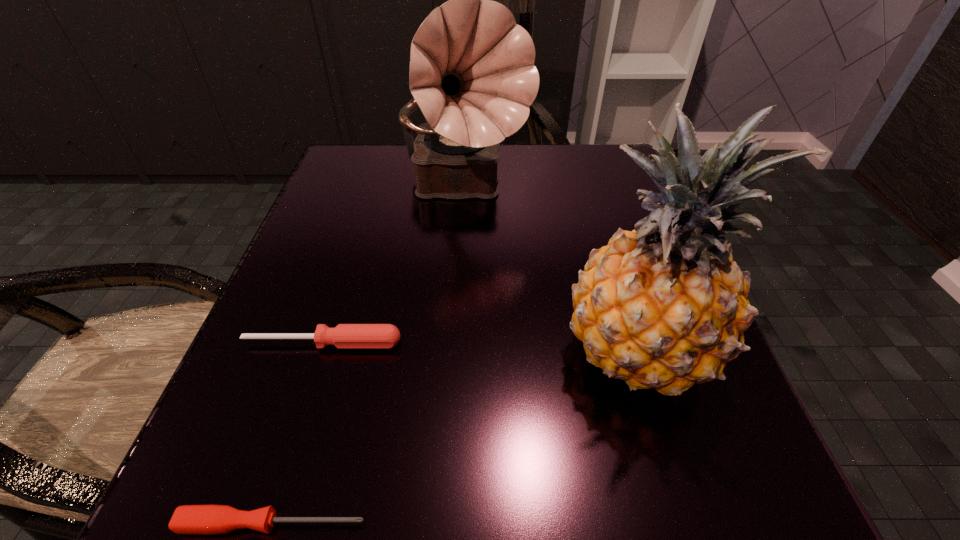
Where is `free space between the record player and the pineapple`? The height and width of the screenshot is (540, 960). free space between the record player and the pineapple is located at coordinates (550, 269).

The image size is (960, 540). In order to click on free space that is in between the record player and the shortest object in this screenshot , I will do `click(369, 356)`.

Select which object appears as the third closest to the pineapple. Please provide its 2D coordinates. Your answer should be formatted as a tuple, i.e. [(x, y)], where the tuple contains the x and y coordinates of a point satisfying the conditions above.

[(188, 519)]

At what (x,y) coordinates should I click in order to perform the action: click on object that is the second closest one to the record player. Please return your answer as a coordinate pair (x, y). Looking at the image, I should click on [x=344, y=336].

This screenshot has height=540, width=960. I want to click on vacant space that satisfies the following two spatial constraints: 1. from the horn of the pineapple; 2. on the left side of the farthest object, so click(457, 349).

In order to click on blank space that satisfies the following two spatial constraints: 1. from the horn of the rightmost object; 2. on the left side of the farthest object in this screenshot , I will do [x=457, y=349].

Where is `vacant region that satisfies the following two spatial constraints: 1. from the horn of the farthest object; 2. at the tip of the nearest object`? The image size is (960, 540). vacant region that satisfies the following two spatial constraints: 1. from the horn of the farthest object; 2. at the tip of the nearest object is located at coordinates (449, 524).

You are a GUI agent. You are given a task and a screenshot of the screen. Output one action in this format:
    pyautogui.click(x=<x>, y=<y>)
    Task: Click on the free spot that satisfies the following two spatial constraints: 1. from the horn of the farthest object; 2. at the tip of the shortest object
    The width and height of the screenshot is (960, 540).
    Given the screenshot: What is the action you would take?
    pyautogui.click(x=449, y=524)

Identify the location of blank area in the image that satisfies the following two spatial constraints: 1. from the horn of the record player; 2. at the tip of the nearest object. (449, 524).